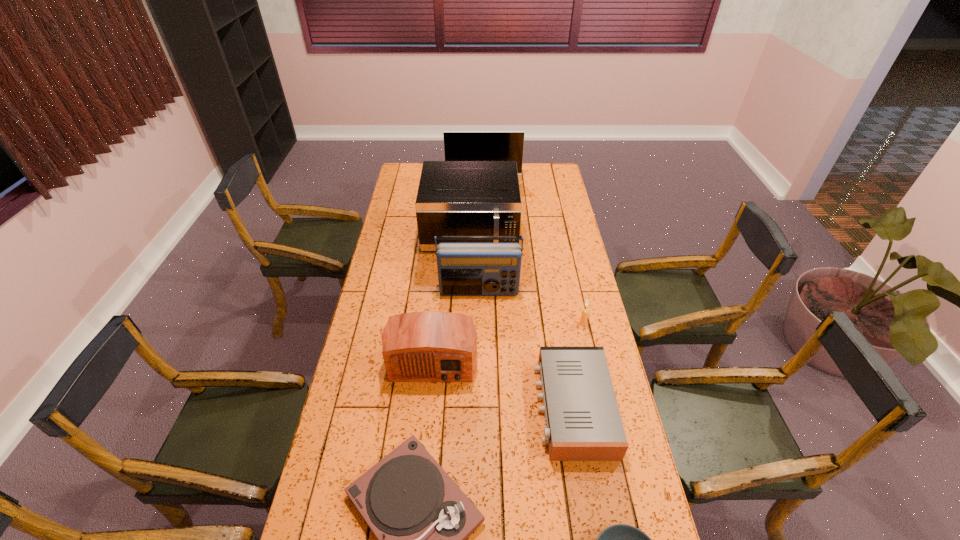
The image size is (960, 540). I want to click on monitor, so click(x=458, y=145).

At what (x,y) coordinates should I click in order to perform the action: click on the farthest radio receiver. Please return your answer as a coordinate pair (x, y). This screenshot has height=540, width=960. Looking at the image, I should click on (464, 269).

Locate an element on the screen. The width and height of the screenshot is (960, 540). the third farthest object is located at coordinates (464, 269).

I want to click on microwave_oven, so click(455, 198).

Where is `the second shortest radio receiver`? The height and width of the screenshot is (540, 960). the second shortest radio receiver is located at coordinates (430, 346).

Identify the location of candle. This screenshot has height=540, width=960. (583, 321).

You are a GUI agent. You are given a task and a screenshot of the screen. Output one action in this format:
    pyautogui.click(x=<x>, y=<y>)
    Task: Click on the fourth shortest object
    This screenshot has width=960, height=540.
    Given the screenshot: What is the action you would take?
    pyautogui.click(x=583, y=321)

Identify the location of the rightmost radio receiver. (583, 423).

This screenshot has height=540, width=960. What are the coordinates of `the sixth tallest object` in the screenshot? It's located at (583, 423).

The width and height of the screenshot is (960, 540). Identify the location of free point located 0.290m on the front-facing side of the farthest object. (484, 220).